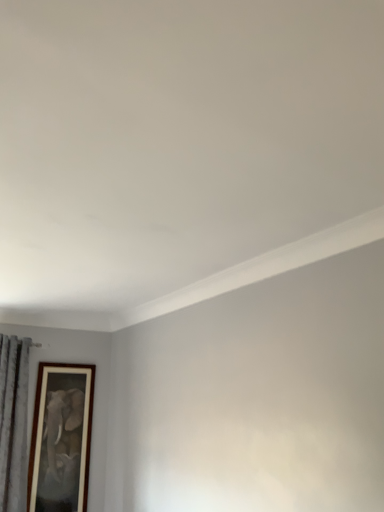
You are a GUI agent. You are given a task and a screenshot of the screen. Output one action in this format:
    pyautogui.click(x=<x>, y=<y>)
    Task: Click on the wooden-framed painting at lower left
    This screenshot has width=384, height=512.
    Given the screenshot: What is the action you would take?
    pyautogui.click(x=61, y=438)

What do you see at coordinates (61, 438) in the screenshot? This screenshot has width=384, height=512. I see `wooden-framed painting at lower left` at bounding box center [61, 438].

I want to click on wooden-framed painting at lower left, so click(61, 438).